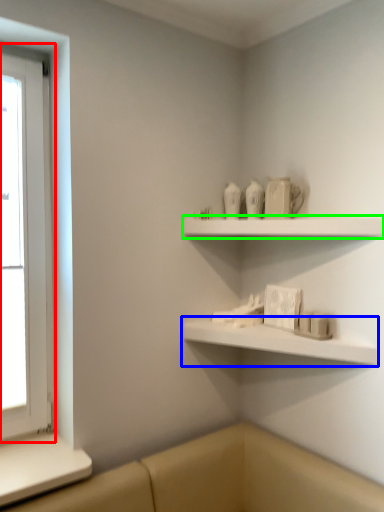
Question: Considering the real-world distances, which object is closest to window (highlighted by a red box)? shelf (highlighted by a blue box) or shelf (highlighted by a green box).

Choices:
 (A) shelf
 (B) shelf

Answer: (B)